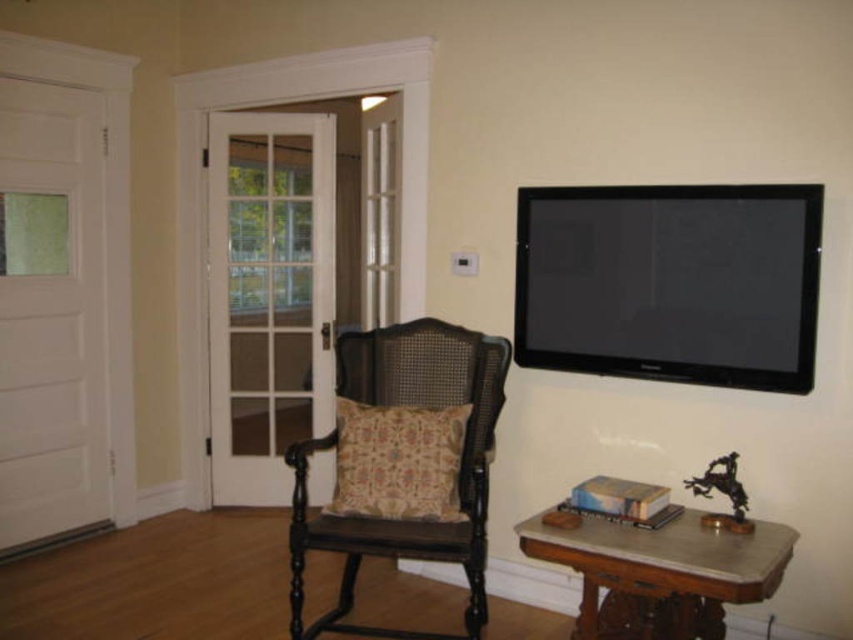
You are planning to move a large potted plant into this room. The plant is as big as the brown wood table at lower right. Can the matte black wooden rocking chair at center accommodate the plant in terms of size?

The matte black wooden rocking chair at center is bigger than the brown wood table at lower right. Since the plant is as big as the brown wood table at lower right, the rocking chair can accommodate the plant in terms of size.

You are standing in the cozy corner of the room and want to move from the white door with a glass panel to the dark wooden rocking chair. Which point, point (724, 266) or point (352, 632), is closer to your starting position?

Point (724, 266) is closer to the starting position because it is in front of point (352, 632).

You are standing in the room depicted in the image and want to move towards the matte black wooden rocking chair at center. Based on the coordinates provided, in which direction should you walk from your current position at point 0.0, 0.0?

The matte black wooden rocking chair at center is located at coordinates [456,481]. Since you are at [0,0], you should walk towards the right and slightly forward to reach it.